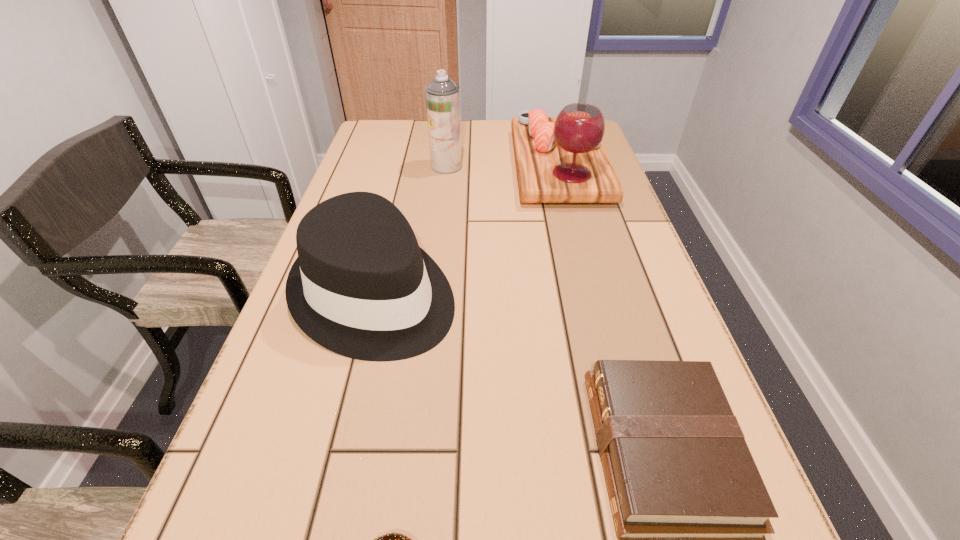
Image resolution: width=960 pixels, height=540 pixels. I want to click on object at the far right corner, so click(x=562, y=159).

Image resolution: width=960 pixels, height=540 pixels. In the image, there is a desktop. Find the location of `vacant space at the far edge`. vacant space at the far edge is located at coordinates (488, 134).

Locate an element on the screen. free space at the left edge of the desktop is located at coordinates (367, 178).

Find the location of a particular element. This screenshot has width=960, height=540. vacant space at the right edge of the desktop is located at coordinates (683, 343).

Where is `free space at the far left corner`? free space at the far left corner is located at coordinates (383, 145).

The image size is (960, 540). Find the location of `free point between the fedora and the second tallest object`. free point between the fedora and the second tallest object is located at coordinates 467,231.

At what (x,y) coordinates should I click in order to perform the action: click on free space between the tallest object and the platter. Please return your answer as a coordinate pair (x, y). Looking at the image, I should click on (x=503, y=166).

I want to click on unoccupied position between the second tallest object and the aerosol can, so click(x=503, y=166).

Point out which object is positioned as the second nearest to the shortest object. Please provide its 2D coordinates. Your answer should be formatted as a tuple, i.e. [(x, y)], where the tuple contains the x and y coordinates of a point satisfying the conditions above.

[(361, 287)]

Select which object appears as the fourth closest to the tallest object. Please provide its 2D coordinates. Your answer should be formatted as a tuple, i.e. [(x, y)], where the tuple contains the x and y coordinates of a point satisfying the conditions above.

[(393, 539)]